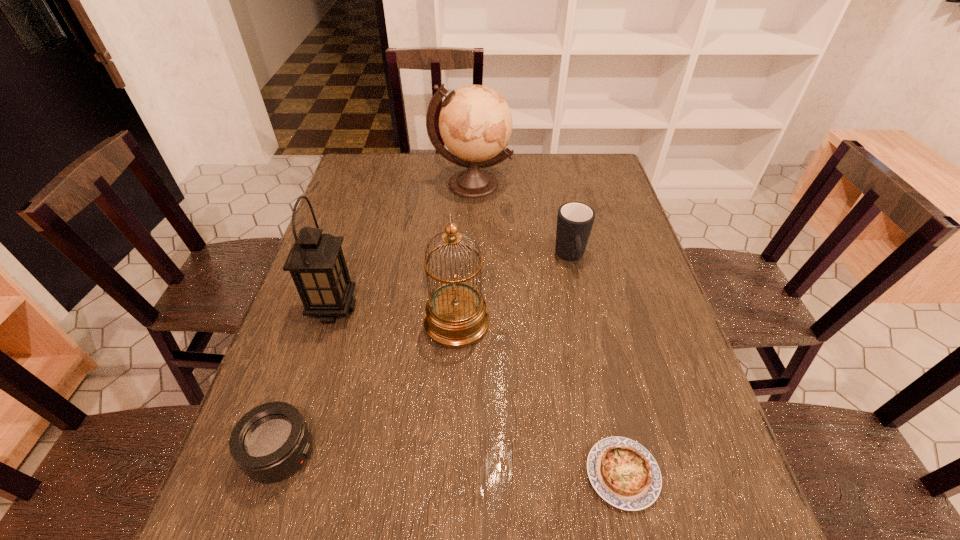
At what (x,y) coordinates should I click in order to perform the action: click on the farthest object. Please return your answer as a coordinate pair (x, y). The image size is (960, 540). Looking at the image, I should click on (475, 122).

The height and width of the screenshot is (540, 960). Find the location of `birdcage`. birdcage is located at coordinates (455, 316).

You are a GUI agent. You are given a task and a screenshot of the screen. Output one action in this format:
    pyautogui.click(x=<x>, y=<y>)
    Task: Click on the lantern
    The height and width of the screenshot is (540, 960).
    Given the screenshot: What is the action you would take?
    pyautogui.click(x=316, y=262)

Find the location of `the fifth nearest object`. the fifth nearest object is located at coordinates (575, 220).

Locate an element on the screen. This screenshot has height=540, width=960. mug is located at coordinates (575, 220).

At what (x,y) coordinates should I click in order to perform the action: click on telephoto lens. Please return your answer as a coordinate pair (x, y). The height and width of the screenshot is (540, 960). Looking at the image, I should click on (272, 441).

Identify the location of the shortest object. (624, 473).

Where is `blank area located on the front-facing side of the farthest object`? The width and height of the screenshot is (960, 540). blank area located on the front-facing side of the farthest object is located at coordinates (470, 247).

The image size is (960, 540). What are the coordinates of `free point located 0.330m with an open door on the birdcage` in the screenshot? It's located at (625, 323).

Locate an element on the screen. This screenshot has width=960, height=540. vacant space located on the back of the lantern is located at coordinates (355, 238).